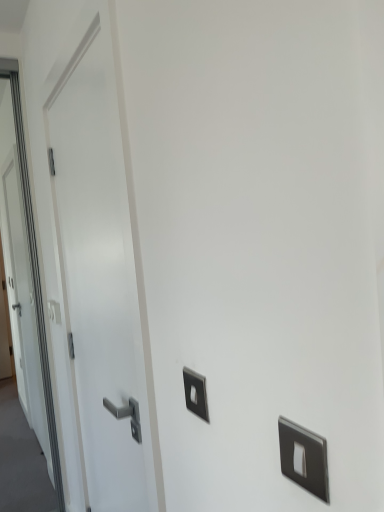
Question: Is satin silver switch at center, which appears as the first light switch when viewed from the right, oriented towards white glossy door at left?

Choices:
 (A) no
 (B) yes

Answer: (A)

Question: From the image's perspective, is satin silver switch at center, which appears as the first light switch when viewed from the right, on top of white glossy door at left?

Choices:
 (A) no
 (B) yes

Answer: (A)

Question: Is satin silver switch at center, which appears as the first light switch when viewed from the right, positioned behind white glossy door at left?

Choices:
 (A) no
 (B) yes

Answer: (A)

Question: From a real-world perspective, is satin silver switch at center, marked as the first light switch in a front-to-back arrangement, over white glossy door at left?

Choices:
 (A) yes
 (B) no

Answer: (B)

Question: From a real-world perspective, is satin silver switch at center, the second light switch when ordered from left to right, positioned under white glossy door at left based on gravity?

Choices:
 (A) yes
 (B) no

Answer: (A)

Question: Considering the relative sizes of satin silver switch at center, which appears as the first light switch when viewed from the right, and white glossy door at left in the image provided, is satin silver switch at center, which appears as the first light switch when viewed from the right, bigger than white glossy door at left?

Choices:
 (A) yes
 (B) no

Answer: (B)

Question: Is white glossy door at left oriented away from satin silver switch at left, acting as the first light switch starting from the left?

Choices:
 (A) yes
 (B) no

Answer: (B)

Question: Can you confirm if white glossy door at left is bigger than satin silver switch at left, acting as the 2th light switch starting from the front?

Choices:
 (A) no
 (B) yes

Answer: (B)

Question: Is white glossy door at left outside of satin silver switch at left, which appears as the first light switch when viewed from the back?

Choices:
 (A) no
 (B) yes

Answer: (B)

Question: Is white glossy door at left not near satin silver switch at left, positioned as the 2th light switch in right-to-left order?

Choices:
 (A) yes
 (B) no

Answer: (B)

Question: From the image's perspective, is white glossy door at left under satin silver switch at left, positioned as the 2th light switch in right-to-left order?

Choices:
 (A) yes
 (B) no

Answer: (B)

Question: Does white glossy door at left appear on the right side of satin silver switch at left, which appears as the first light switch when viewed from the back?

Choices:
 (A) yes
 (B) no

Answer: (A)

Question: Is white glossy door at left at the back of satin silver switch at left, positioned as the 2th light switch in right-to-left order?

Choices:
 (A) yes
 (B) no

Answer: (B)